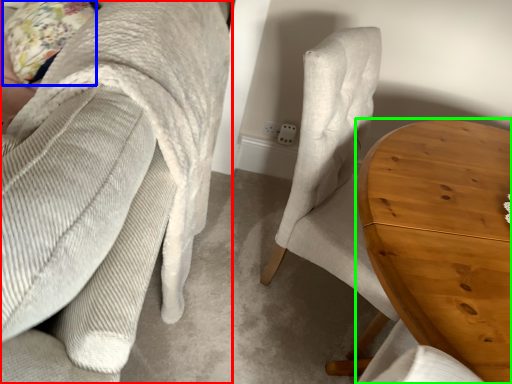
Question: Which object is the farthest from chair (highlighted by a red box)? Choose among these: pillow (highlighted by a blue box) or table (highlighted by a green box).

Choices:
 (A) pillow
 (B) table

Answer: (A)